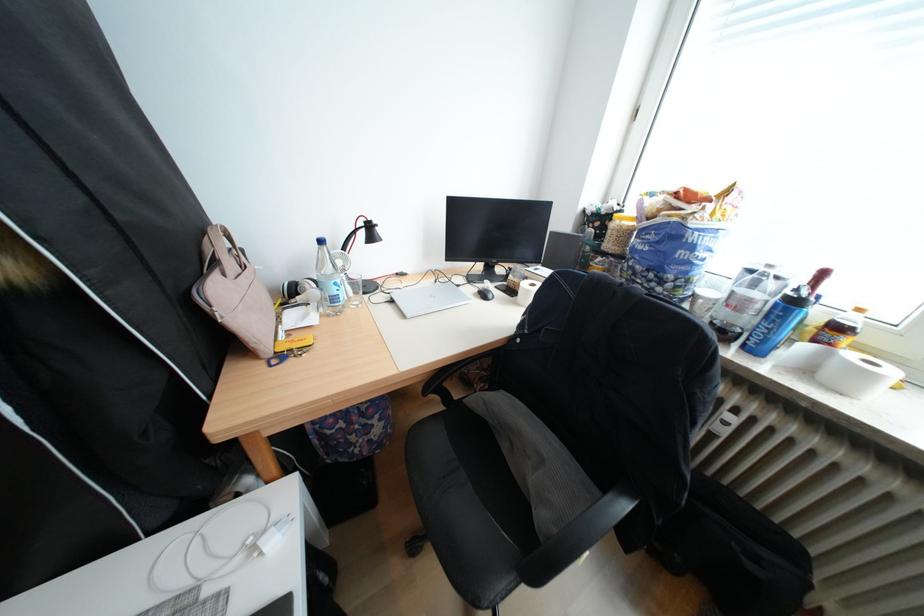
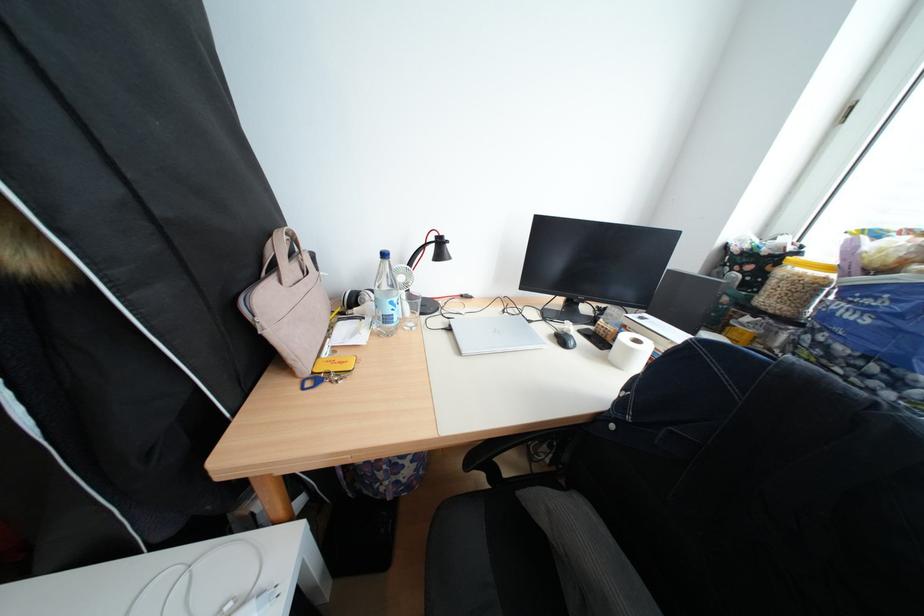
Question: Which direction would the cameraman need to move to produce the second image? Reply with the corresponding letter.

Choices:
 (A) Left
 (B) Right
 (C) Forward
 (D) Backward

Answer: (C)